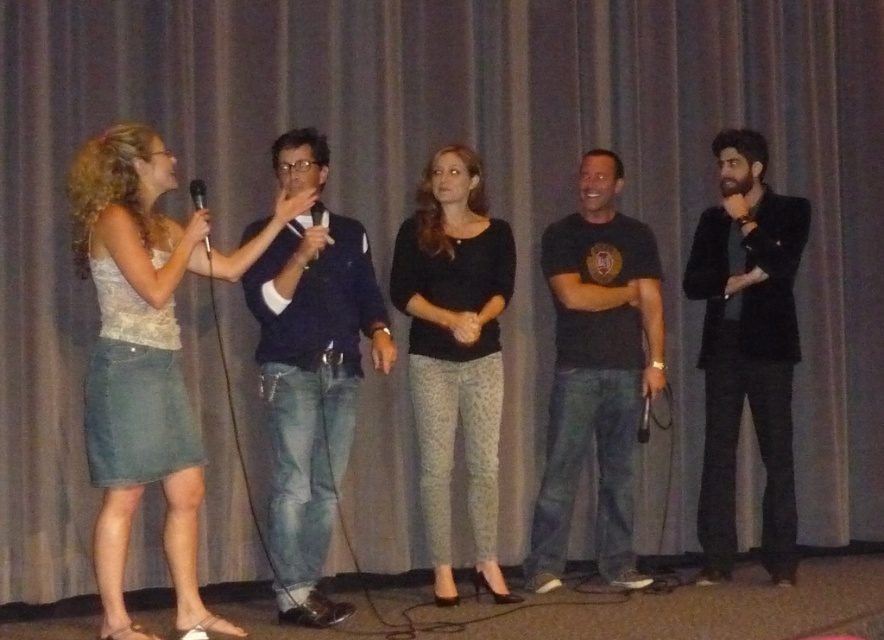
Is denim skirt at left below black matte microphone at upper left?

Indeed, denim skirt at left is positioned under black matte microphone at upper left.

This screenshot has width=884, height=640. In order to click on denim skirt at left in this screenshot , I will do `click(145, 358)`.

Who is more distant from viewer, (105,531) or (196,179)?

The point (196,179) is behind.

What are the coordinates of `denim skirt at left` in the screenshot? It's located at (145, 358).

Can you confirm if dark blue denim jeans at center is shorter than black velvet jacket at right?

Yes.

Measure the distance between point (299, 404) and camera.

The distance of point (299, 404) from camera is 4.01 meters.

Where is `dark blue denim jeans at center`? Image resolution: width=884 pixels, height=640 pixels. dark blue denim jeans at center is located at coordinates (311, 390).

You are a GUI agent. You are given a task and a screenshot of the screen. Output one action in this format:
    pyautogui.click(x=<x>, y=<y>)
    Task: Click on the dark blue denim jeans at center
    The image size is (884, 640).
    Given the screenshot: What is the action you would take?
    pyautogui.click(x=311, y=390)

Is dark blue denim jeans at center to the right of black matte microphone at upper left from the viewer's perspective?

Yes, dark blue denim jeans at center is to the right of black matte microphone at upper left.

Where is `dark blue denim jeans at center`? The image size is (884, 640). dark blue denim jeans at center is located at coordinates (311, 390).

In order to click on dark blue denim jeans at center in this screenshot , I will do `click(311, 390)`.